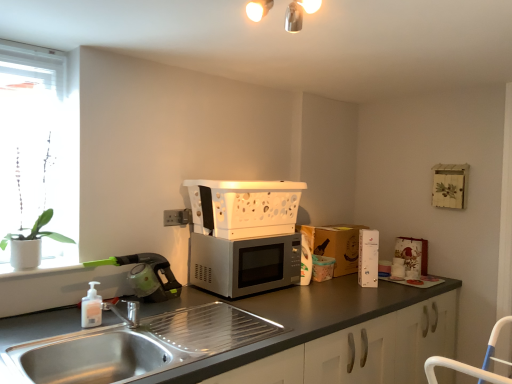
Image resolution: width=512 pixels, height=384 pixels. Find the location of `free spot behind white matte soap dispenser at sink left`. free spot behind white matte soap dispenser at sink left is located at coordinates (109, 309).